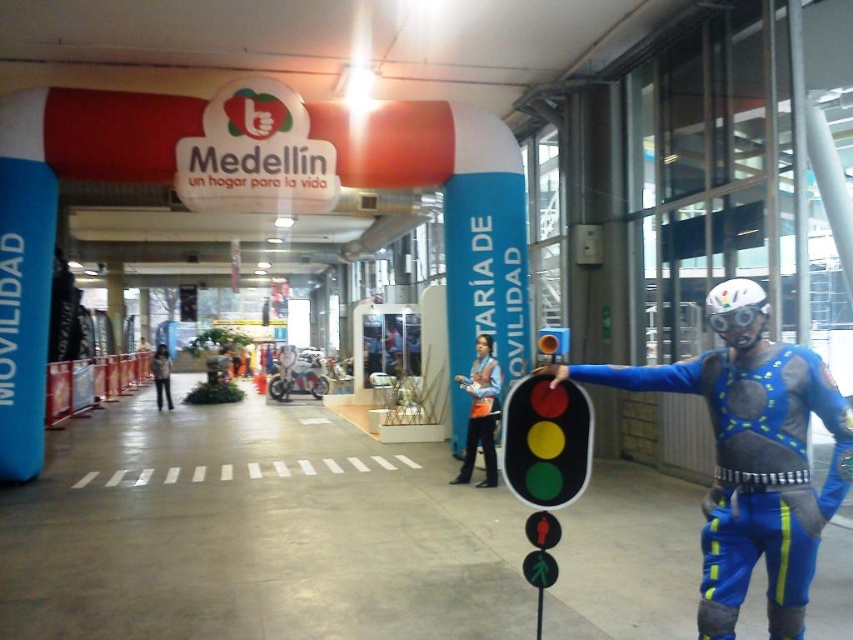
You are organizing a parade and need to decide which item to prioritize packing based on size. Given the blue fabric costume at center and the denim jacket at center, which one should you pack first if you want to save space?

The blue fabric costume at center occupies less space than the denim jacket at center, so you should pack the blue fabric costume at center first to save space.

You are a photographer trying to capture both the blue fabric costume at center and the denim jacket at center in the same frame. Based on their positions, which one should you adjust your camera angle to focus on first to ensure both are in the shot?

The blue fabric costume at center is positioned on the right side of denim jacket at center, so you should adjust your camera angle to focus on the denim jacket at center first to ensure both are in the shot.

You are standing at the entrance of the venue and want to approach both the orange safety vest at center and the denim jacket at center. Which item is closer to you?

The orange safety vest at center is 11.42 meters away from the denim jacket at center, so the distance between them is 11.42 meters. However, since both are at center, they are equidistant from the entrance.